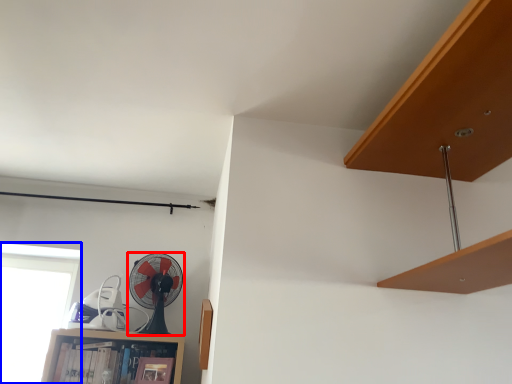
Question: Which object is closer to the camera taking this photo, mechanical fan (highlighted by a red box) or window (highlighted by a blue box)?

Choices:
 (A) mechanical fan
 (B) window

Answer: (A)